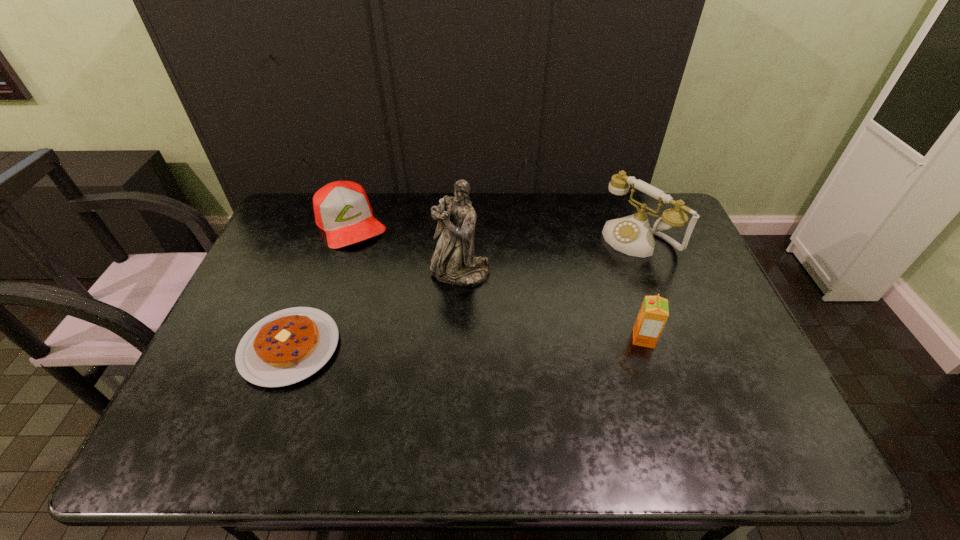
Identify the location of vacant space on the desktop that is between the pancake and the orange juice and is positioned on the front-facing side of the fourth tallest object. This screenshot has width=960, height=540. (428, 344).

Find the location of `vacant space on the desktop that is between the shortest object and the orange juice and is positioned on the dial of the telephone`. vacant space on the desktop that is between the shortest object and the orange juice and is positioned on the dial of the telephone is located at coordinates (487, 342).

Locate an element on the screen. The height and width of the screenshot is (540, 960). free space on the desktop that is between the shortest object and the third shortest object and is positioned on the front-facing side of the figurine is located at coordinates (419, 344).